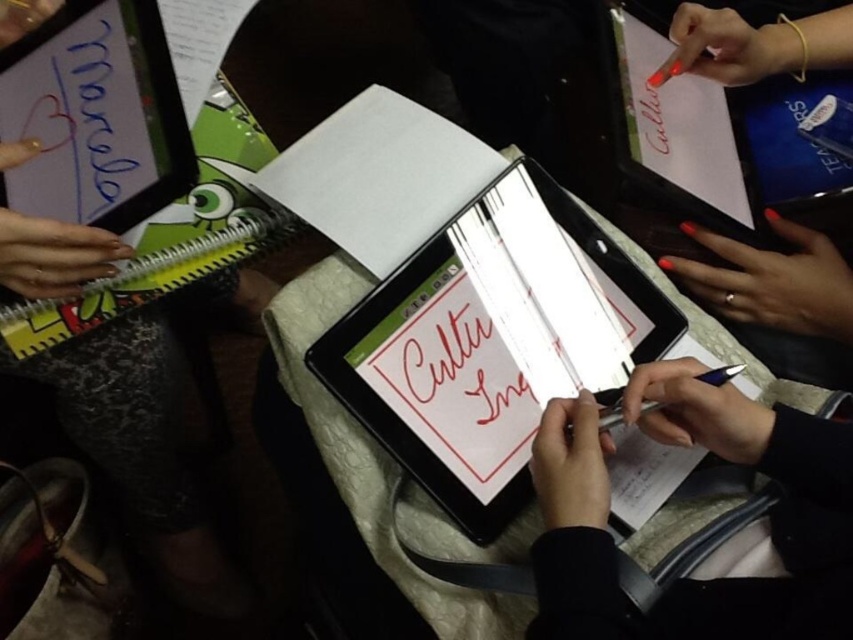
In the scene, there is a tablet displaying the text and a white paper at center represented by point (490,342). Can you determine if the white paper at center is positioned above or below the tablet?

The white paper at center represented by point (490,342) is positioned above the tablet since its coordinates are higher than the tablet.

You are an artist working on a project. You have a white paper at center and a smooth black tablet at center. Which surface should you draw on if you want your work to be visible against the background?

The white paper at center is located above the smooth black tablet at center, so drawing on the white paper at center would be more visible against the black tablet at center.